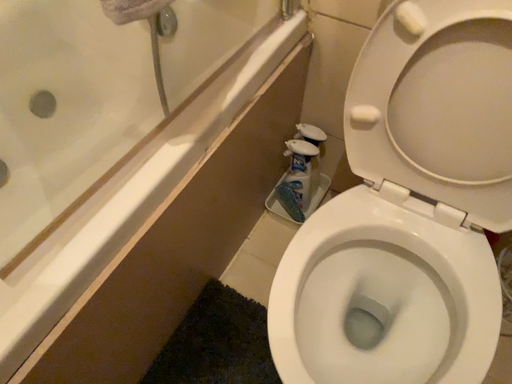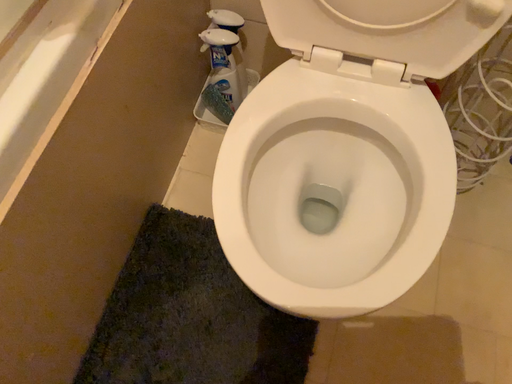
Question: Which way did the camera rotate in the video?

Choices:
 (A) rotated downward
 (B) rotated upward

Answer: (A)